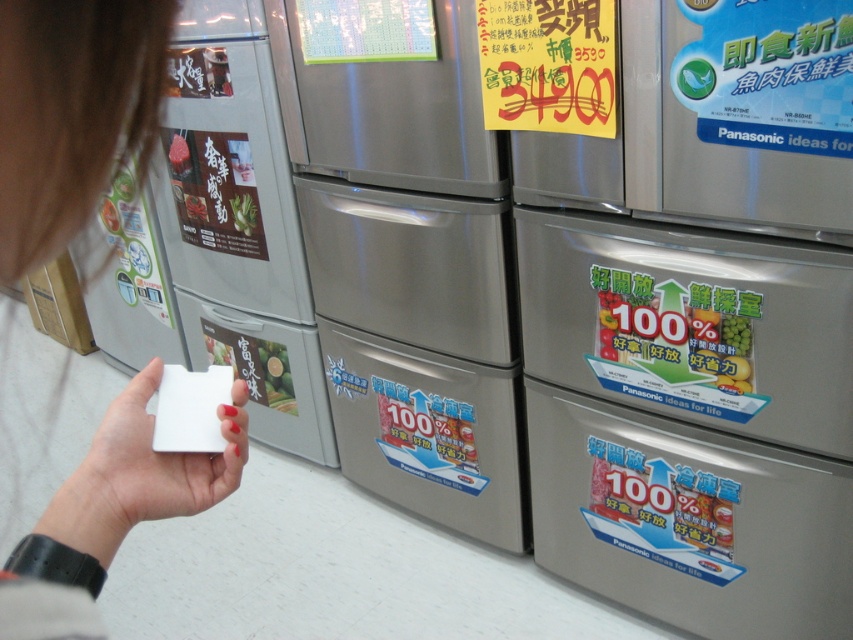
You are helping a customer compare two refrigerators in the store. The customer wants to know which one is shorter. You see the satin silver refrigerator at center and the satin silver refrigerator at left. Which one should you point out?

The satin silver refrigerator at center is not as tall as the satin silver refrigerator at left, so you should point out the satin silver refrigerator at center as the shorter one.

You are a customer looking at the refrigerators. The store has a height restriction of 6 feet for all appliances. If the satin silver refrigerator at left is taller than the green matte refrigerator at center, which one might exceed the height limit?

A: The satin silver refrigerator at left is taller than the green matte refrigerator at center, so it might exceed the 6 feet height limit.